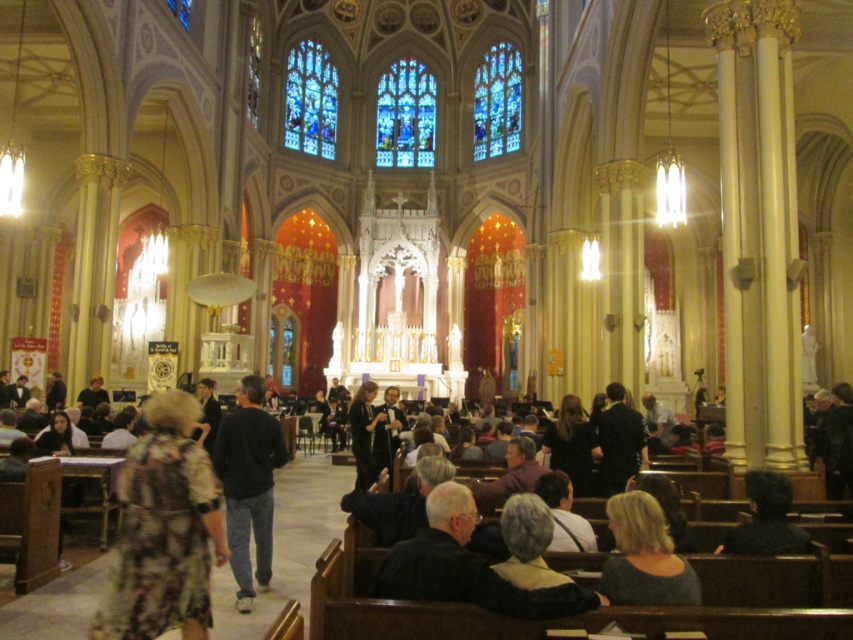
How distant is floral-patterned dress at lower left from stained glass window at upper center?

floral-patterned dress at lower left and stained glass window at upper center are 72.08 meters apart.

Is point (190, 426) positioned after point (509, 122)?

No, it is in front of (509, 122).

Who is more distant from viewer, (167,577) or (492,134)?

The point (492,134) is more distant.

Locate an element on the screen. The width and height of the screenshot is (853, 640). floral-patterned dress at lower left is located at coordinates (163, 531).

Is stained glass window at upper center bigger than dark brown hair at lower right?

Yes, stained glass window at upper center is bigger than dark brown hair at lower right.

Measure the distance between stained glass window at upper center and dark brown hair at lower right.

stained glass window at upper center is 305.11 feet away from dark brown hair at lower right.

Is point (515, 131) positioned after point (752, 544)?

That is True.

I want to click on stained glass window at upper center, so click(497, 102).

Who is higher up, black sweater at center or dark brown hair at lower right?

black sweater at center

Consider the image. Does black sweater at center have a lesser width compared to dark brown hair at lower right?

No.

Describe the element at coordinates (248, 484) in the screenshot. I see `black sweater at center` at that location.

Find the location of `black sweater at center`. black sweater at center is located at coordinates (248, 484).